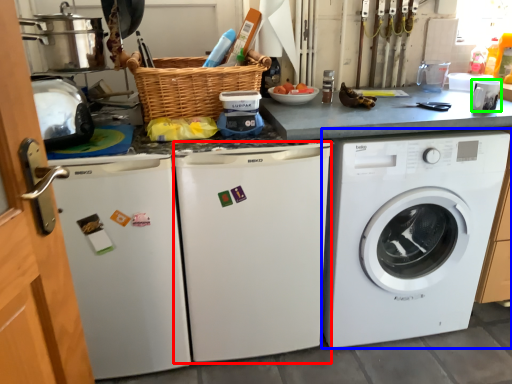
Question: Estimate the real-world distances between objects in this image. Which object is closer to dish washer (highlighted by a red box), washing machine (highlighted by a blue box) or appliance (highlighted by a green box)?

Choices:
 (A) washing machine
 (B) appliance

Answer: (A)